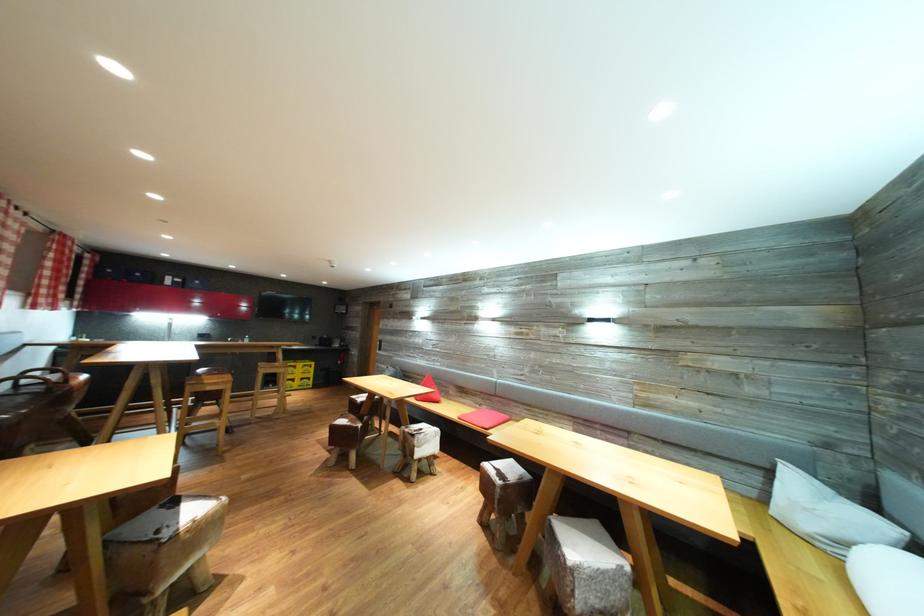
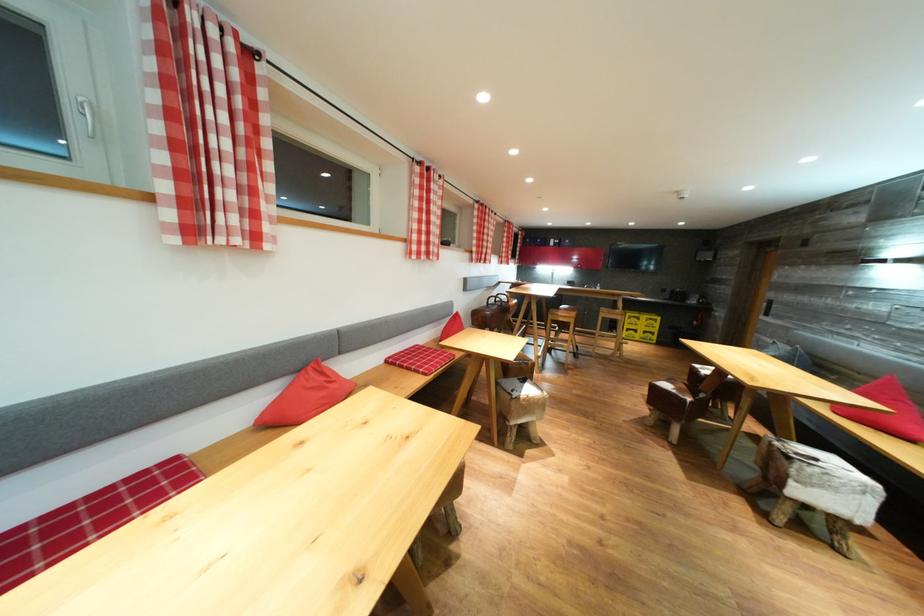
Find the pixel in the second image that matches (x=428, y=435) in the first image.

(821, 464)